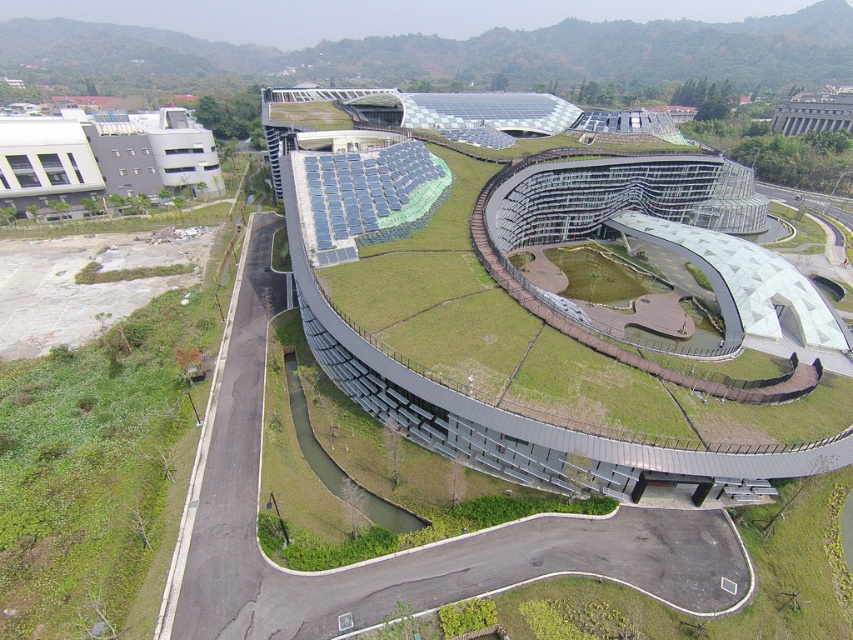
Question: Is green matte building at center to the left of metallic gray building at upper right from the viewer's perspective?

Choices:
 (A) yes
 (B) no

Answer: (A)

Question: From the image, what is the correct spatial relationship of white matte building at upper left in relation to metallic gray building at upper right?

Choices:
 (A) right
 (B) left

Answer: (B)

Question: Which point is farther to the camera?

Choices:
 (A) (199, 172)
 (B) (819, 449)

Answer: (A)

Question: Which object is positioned closest to the white matte building at upper left?

Choices:
 (A) green matte building at center
 (B) metallic gray building at upper right

Answer: (A)

Question: In this image, where is green matte building at center located relative to metallic gray building at upper right?

Choices:
 (A) above
 (B) below

Answer: (B)

Question: Which of the following is the farthest from the observer?

Choices:
 (A) white matte building at upper left
 (B) metallic gray building at upper right
 (C) green matte building at center

Answer: (B)